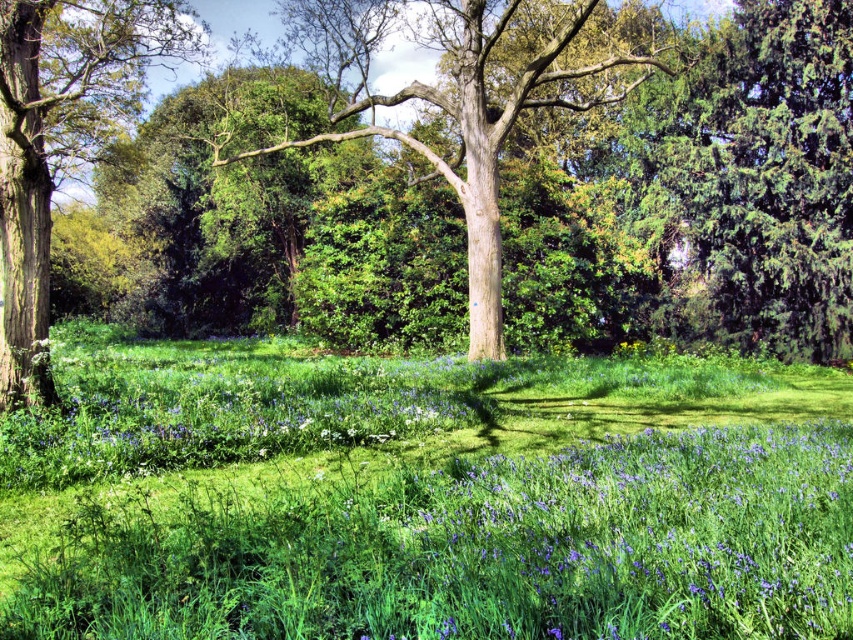
You are standing in the meadow and want to place a picnic blanket exactly at the center of the green grassy field at center. According to the coordinates provided, where should you place the blanket?

The green grassy field at center is located at coordinates point (422, 496), so you should place the picnic blanket at that exact point.

You are standing in the meadow and want to take a photo of the green textured evergreen tree at upper right. Based on its position, which direction should you face to capture it in your camera view?

The green textured evergreen tree at upper right is located at point coordinates, so you should face towards the upper right direction to capture it in your camera view.

You are planning to plant a new tree in this area. The green textured evergreen tree at upper right and the smooth brown tree trunk at left are already present. Which tree should you choose for a taller canopy to provide more shade? Please explain your choice based on their current heights.

The smooth brown tree trunk at left is taller than the green textured evergreen tree at upper right, so it would provide a taller canopy and more shade.